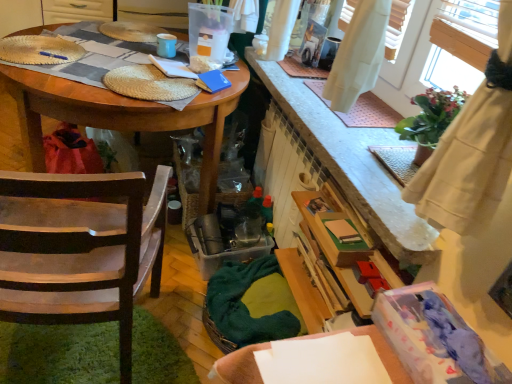
You are a GUI agent. You are given a task and a screenshot of the screen. Output one action in this format:
    pyautogui.click(x=<x>, y=<y>)
    Task: Click on the wooden table at left
    The height and width of the screenshot is (384, 512).
    Given the screenshot: What is the action you would take?
    pyautogui.click(x=106, y=118)

In order to face wooden table at left, should I rotate leftwards or rightwards?

It's best to rotate left around 16.789 degrees.

This screenshot has width=512, height=384. Describe the element at coordinates (106, 118) in the screenshot. I see `wooden table at left` at that location.

The height and width of the screenshot is (384, 512). Find the location of `wooden chair at left`. wooden chair at left is located at coordinates (80, 249).

The width and height of the screenshot is (512, 384). What do you see at coordinates (80, 249) in the screenshot?
I see `wooden chair at left` at bounding box center [80, 249].

What is the approximate height of wooden chair at left?

wooden chair at left is 35.24 inches tall.

Identify the location of wooden table at left. (106, 118).

Can you confirm if wooden table at left is positioned to the right of wooden chair at left?

In fact, wooden table at left is to the left of wooden chair at left.

Is the position of wooden table at left more distant than that of wooden chair at left?

Yes, wooden table at left is further from the camera.

Which is farther, [109,102] or [41,225]?

Point [109,102]

From the image's perspective, which is above, wooden table at left or wooden chair at left?

wooden table at left, from the image's perspective.

From the picture: From a real-world perspective, does wooden table at left sit lower than wooden chair at left?

Indeed, from a real-world perspective, wooden table at left is positioned beneath wooden chair at left.

Can you confirm if wooden table at left is wider than wooden chair at left?

Yes, wooden table at left is wider than wooden chair at left.

Considering the sizes of wooden table at left and wooden chair at left in the image, is wooden table at left taller or shorter than wooden chair at left?

Clearly, wooden table at left is shorter compared to wooden chair at left.

Considering the relative sizes of wooden table at left and wooden chair at left in the image provided, is wooden table at left bigger than wooden chair at left?

Indeed, wooden table at left has a larger size compared to wooden chair at left.

In the scene shown: Does wooden table at left contain wooden chair at left?

No, wooden table at left does not contain wooden chair at left.

Is wooden table at left far from wooden chair at left?

wooden table at left is actually quite close to wooden chair at left.

Could you tell me if wooden table at left is facing wooden chair at left?

No.

Looking at this image, can you tell me how much wooden table at left and wooden chair at left differ in facing direction?

There is a 95.8-degree angle between the facing directions of wooden table at left and wooden chair at left.

How distant is wooden table at left from wooden chair at left?

wooden table at left is 22.88 inches from wooden chair at left.

The height and width of the screenshot is (384, 512). Find the location of `desk above the wooden chair at left (from the image's perspective)`. desk above the wooden chair at left (from the image's perspective) is located at coordinates [106, 118].

Is wooden chair at left to the left of wooden table at left from the viewer's perspective?

In fact, wooden chair at left is to the right of wooden table at left.

In the image, is wooden chair at left positioned in front of or behind wooden table at left?

Visually, wooden chair at left is located in front of wooden table at left.

Which is nearer, (55, 265) or (194, 120)?

Point (55, 265)

From the image's perspective, is wooden chair at left beneath wooden table at left?

Indeed, from the image's perspective, wooden chair at left is shown beneath wooden table at left.

From a real-world perspective, is wooden chair at left over wooden table at left?

Yes, from a real-world perspective, wooden chair at left is on top of wooden table at left.

In terms of width, does wooden chair at left look wider or thinner when compared to wooden table at left?

Clearly, wooden chair at left has less width compared to wooden table at left.

Does wooden chair at left have a greater height compared to wooden table at left?

Yes, wooden chair at left is taller than wooden table at left.

Which of these two, wooden chair at left or wooden table at left, is smaller?

Smaller between the two is wooden chair at left.

Is wooden chair at left spatially inside wooden table at left, or outside of it?

wooden chair at left lies outside wooden table at left.

Are wooden chair at left and wooden table at left far apart?

No, there isn't a large distance between wooden chair at left and wooden table at left.

Could you tell me if wooden chair at left is turned towards wooden table at left?

Yes, wooden chair at left is facing wooden table at left.

Locate an element on the screen. Image resolution: width=512 pixels, height=384 pixels. desk behind the wooden chair at left is located at coordinates (106, 118).

The width and height of the screenshot is (512, 384). I want to click on desk beneath the wooden chair at left (from a real-world perspective), so click(106, 118).

Locate an element on the screen. Image resolution: width=512 pixels, height=384 pixels. desk above the wooden chair at left (from the image's perspective) is located at coordinates (106, 118).